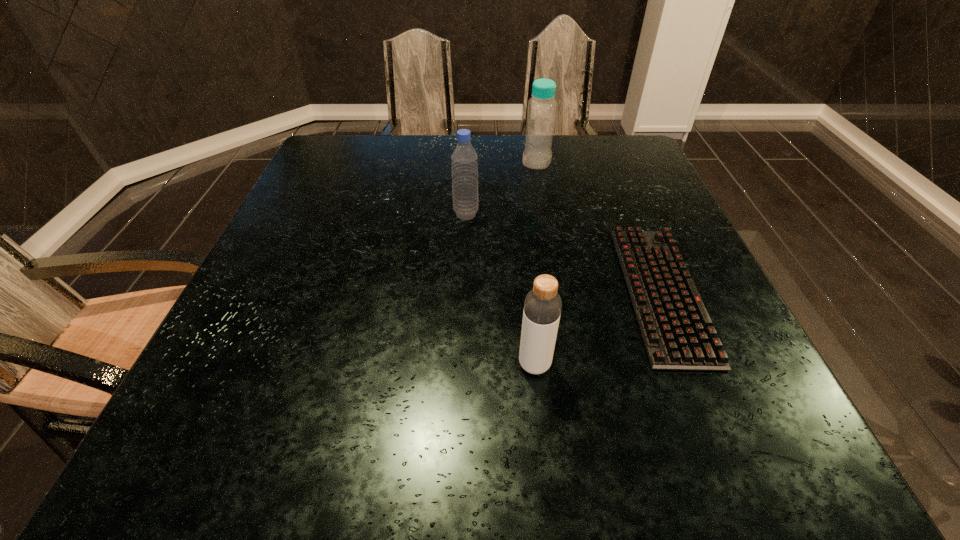
Locate an element on the screen. This screenshot has width=960, height=540. object that is at the far edge is located at coordinates tap(541, 111).

The image size is (960, 540). Find the location of `object that is at the right edge`. object that is at the right edge is located at coordinates (677, 332).

The image size is (960, 540). In order to click on vacant space at the far edge of the desktop in this screenshot , I will do `click(516, 151)`.

Image resolution: width=960 pixels, height=540 pixels. I want to click on vacant space at the left edge of the desktop, so click(280, 305).

The width and height of the screenshot is (960, 540). Identify the location of vacant region at the right edge. (644, 187).

Where is `free region at the far left corner of the desktop`? This screenshot has height=540, width=960. free region at the far left corner of the desktop is located at coordinates (359, 160).

Locate an element on the screen. The height and width of the screenshot is (540, 960). free space at the near left corner of the desktop is located at coordinates (213, 474).

This screenshot has width=960, height=540. In the image, there is a desktop. What are the coordinates of `vacant area at the far right corner` in the screenshot? It's located at (657, 176).

Locate an element on the screen. vacant space at the near right corner of the desktop is located at coordinates (765, 455).

Where is `blank region between the computer keyboard and the nearest bottle`? Image resolution: width=960 pixels, height=540 pixels. blank region between the computer keyboard and the nearest bottle is located at coordinates (598, 328).